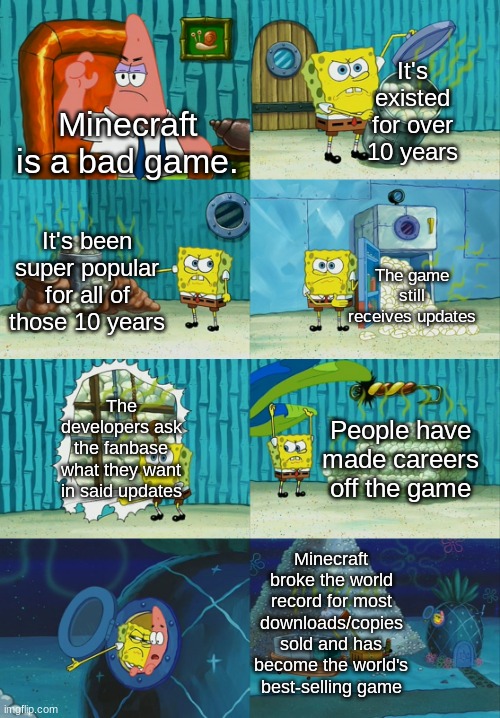
Identify the location of window. (122, 380).